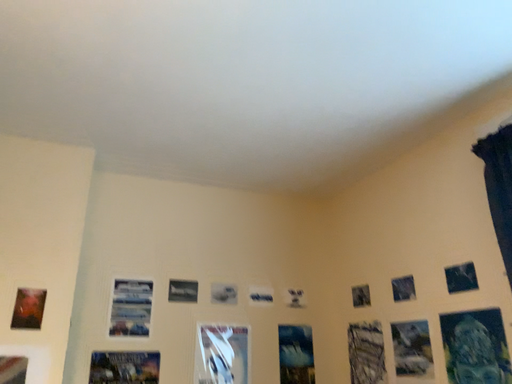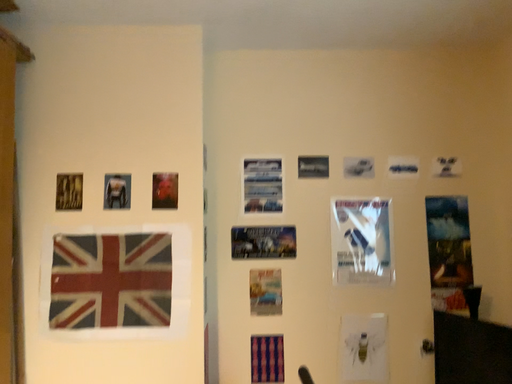
Question: Which way did the camera rotate in the video?

Choices:
 (A) rotated left
 (B) rotated right

Answer: (A)